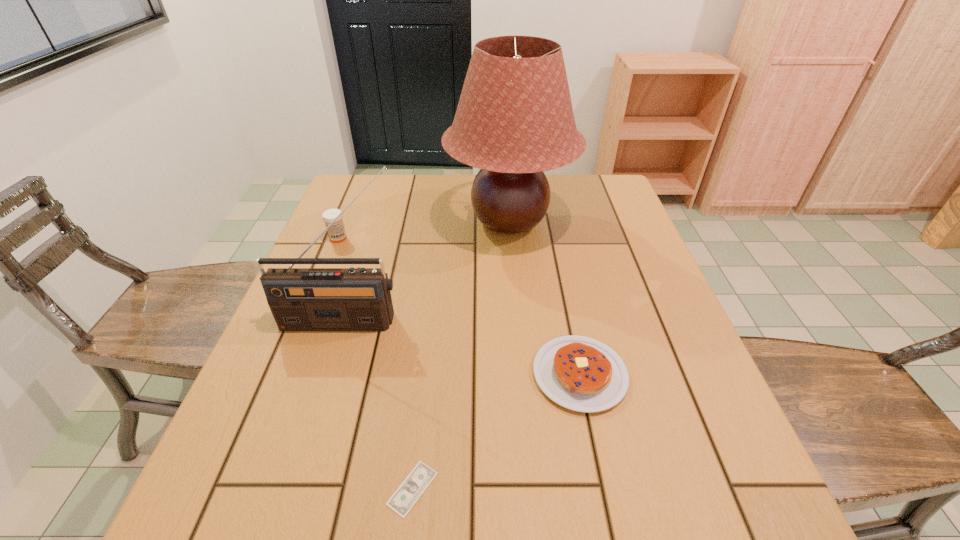
This screenshot has width=960, height=540. Identify the location of the tallest object. [x=514, y=120].

The width and height of the screenshot is (960, 540). Find the location of `radio receiver`. radio receiver is located at coordinates (301, 299).

Where is `the third farthest object`? The height and width of the screenshot is (540, 960). the third farthest object is located at coordinates (301, 299).

Identify the location of the third shortest object. (336, 232).

Identify the location of the fourth tallest object. Image resolution: width=960 pixels, height=540 pixels. (580, 373).

Locate an element on the screen. pancake is located at coordinates (580, 373).

The width and height of the screenshot is (960, 540). I want to click on money, so click(x=411, y=489).

The image size is (960, 540). I want to click on the shortest object, so click(x=411, y=489).

Where is `free region located 0.340m on the front-facing side of the lampshade`? This screenshot has height=540, width=960. free region located 0.340m on the front-facing side of the lampshade is located at coordinates (522, 368).

At what (x,y) coordinates should I click in order to perform the action: click on free spot located 0.180m on the front-facing side of the radio receiver. Please return your answer as a coordinate pair (x, y). Looking at the image, I should click on (316, 404).